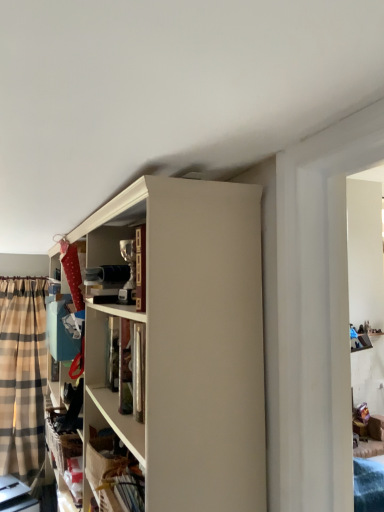
Question: Is plaid fabric curtain at left next to metallic silver trophy at upper center and touching it?

Choices:
 (A) no
 (B) yes

Answer: (A)

Question: Could you tell me if plaid fabric curtain at left is facing metallic silver trophy at upper center?

Choices:
 (A) yes
 (B) no

Answer: (A)

Question: Is plaid fabric curtain at left positioned in front of metallic silver trophy at upper center?

Choices:
 (A) yes
 (B) no

Answer: (B)

Question: Considering the relative sizes of plaid fabric curtain at left and metallic silver trophy at upper center in the image provided, is plaid fabric curtain at left smaller than metallic silver trophy at upper center?

Choices:
 (A) no
 (B) yes

Answer: (A)

Question: Is plaid fabric curtain at left positioned with its back to metallic silver trophy at upper center?

Choices:
 (A) yes
 (B) no

Answer: (B)

Question: Does plaid fabric curtain at left have a greater height compared to metallic silver trophy at upper center?

Choices:
 (A) no
 (B) yes

Answer: (B)

Question: Is metallic silver trophy at upper center far away from plaid fabric curtain at left?

Choices:
 (A) yes
 (B) no

Answer: (A)

Question: Considering the relative sizes of metallic silver trophy at upper center and plaid fabric curtain at left in the image provided, is metallic silver trophy at upper center shorter than plaid fabric curtain at left?

Choices:
 (A) no
 (B) yes

Answer: (B)

Question: From a real-world perspective, is metallic silver trophy at upper center under plaid fabric curtain at left?

Choices:
 (A) no
 (B) yes

Answer: (A)

Question: Is metallic silver trophy at upper center directly adjacent to plaid fabric curtain at left?

Choices:
 (A) yes
 (B) no

Answer: (B)

Question: Is metallic silver trophy at upper center not within plaid fabric curtain at left?

Choices:
 (A) yes
 (B) no

Answer: (A)

Question: Does metallic silver trophy at upper center have a lesser width compared to plaid fabric curtain at left?

Choices:
 (A) no
 (B) yes

Answer: (B)

Question: From their relative heights in the image, would you say plaid fabric curtain at left is taller or shorter than metallic silver trophy at upper center?

Choices:
 (A) short
 (B) tall

Answer: (B)